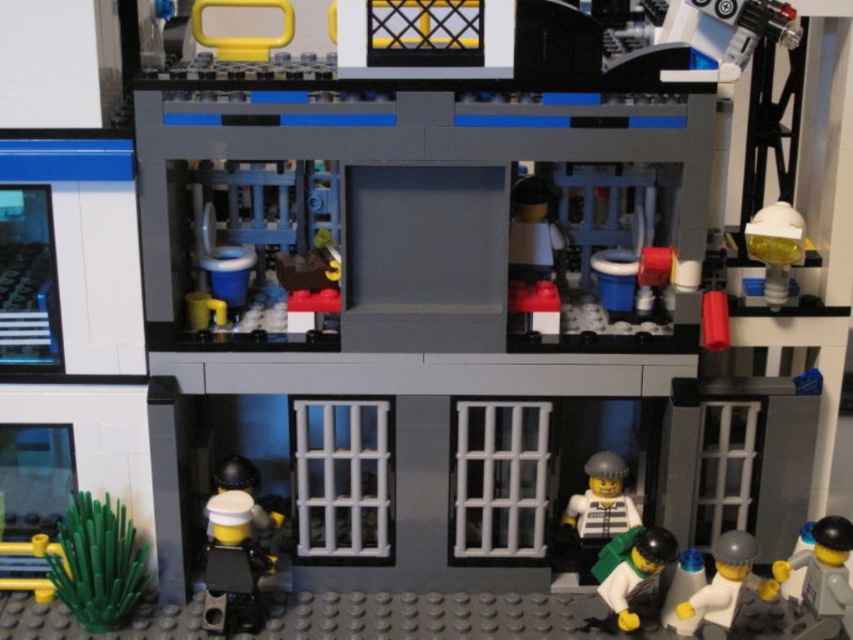
Which is behind, point (810, 608) or point (682, 580)?

Positioned behind is point (682, 580).

Consider the image. Can you confirm if light gray plastic minifigure at lower right is positioned to the left of smooth white figure at lower right?

In fact, light gray plastic minifigure at lower right is to the right of smooth white figure at lower right.

This screenshot has width=853, height=640. What do you see at coordinates (822, 579) in the screenshot? I see `light gray plastic minifigure at lower right` at bounding box center [822, 579].

What are the coordinates of `light gray plastic minifigure at lower right` in the screenshot? It's located at (822, 579).

Between light gray plastic minifigure at lower right and white matte minifigure at lower right, which one is positioned lower?

white matte minifigure at lower right is lower down.

Is light gray plastic minifigure at lower right to the left of white matte minifigure at lower right from the viewer's perspective?

Incorrect, light gray plastic minifigure at lower right is not on the left side of white matte minifigure at lower right.

The width and height of the screenshot is (853, 640). Describe the element at coordinates (822, 579) in the screenshot. I see `light gray plastic minifigure at lower right` at that location.

Locate an element on the screen. The width and height of the screenshot is (853, 640). light gray plastic minifigure at lower right is located at coordinates (822, 579).

Is white matte minifigure at lower right positioned behind smooth white figure at lower right?

No, it is in front of smooth white figure at lower right.

Does point (727, 552) come behind point (683, 550)?

No, it is in front of (683, 550).

You are a GUI agent. You are given a task and a screenshot of the screen. Output one action in this format:
    pyautogui.click(x=<x>, y=<y>)
    Task: Click on the white matte minifigure at lower right
    The image size is (853, 640).
    Given the screenshot: What is the action you would take?
    coord(722,586)